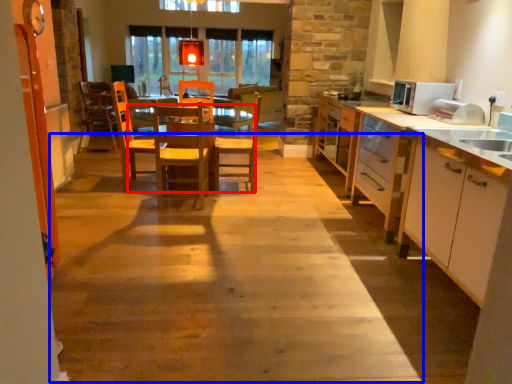
Question: Which point is further to the camera, table (highlighted by a red box) or path (highlighted by a blue box)?

Choices:
 (A) table
 (B) path

Answer: (A)